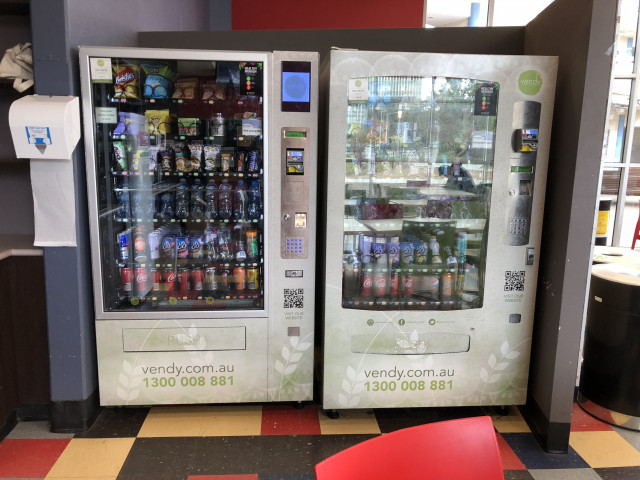
You are a GUI agent. You are given a task and a screenshot of the screen. Output one action in this format:
    pyautogui.click(x=<x>, y=<y>)
    Task: Click on the floor tiles
    The width and height of the screenshot is (640, 480).
    Given the screenshot: What is the action you would take?
    pyautogui.click(x=106, y=445)